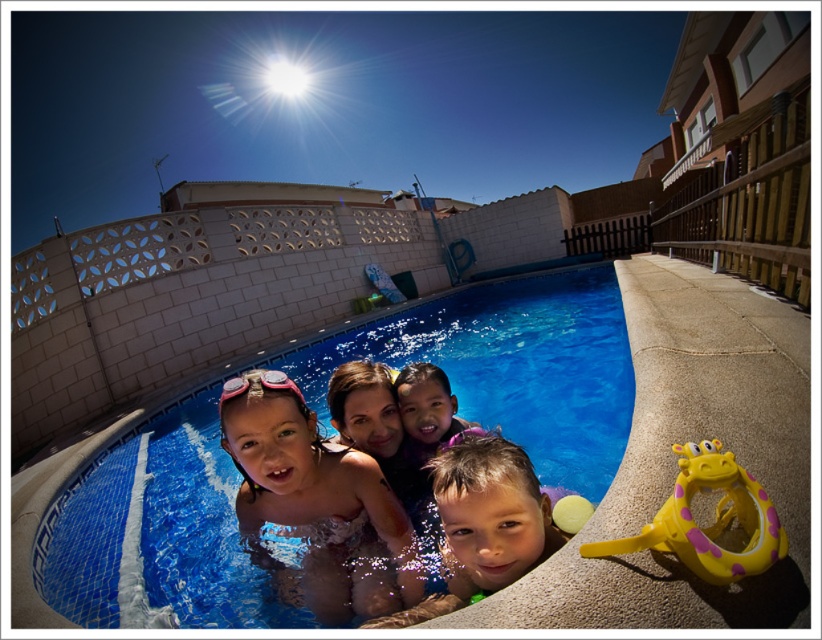
You are standing at the edge of the blue tile swimming pool at center and see the yellow rubber ring at lower right. Which object is closer to the water surface?

The yellow rubber ring at lower right is closer to the water surface because the blue tile swimming pool at center is located above it.

Where is the smooth skin child at center located in the image?

The smooth skin child at center is located at point (483,524).

You are standing at the center of the image. Which direction should you move to reach the blue tile swimming pool at center?

The blue tile swimming pool at center is already at the center of the image, so you don not need to move in any direction to reach it.